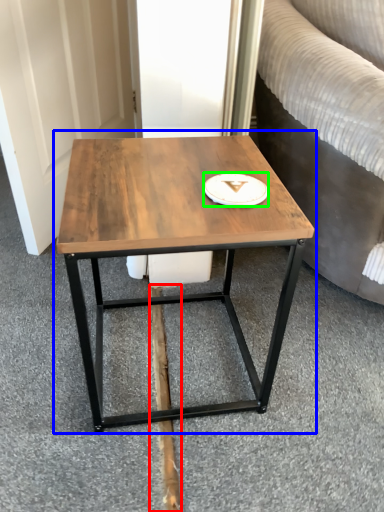
Question: Which object is positioned farthest from plank (highlighted by a red box)? Select from coffee table (highlighted by a blue box) and platter (highlighted by a green box).

Choices:
 (A) coffee table
 (B) platter

Answer: (B)